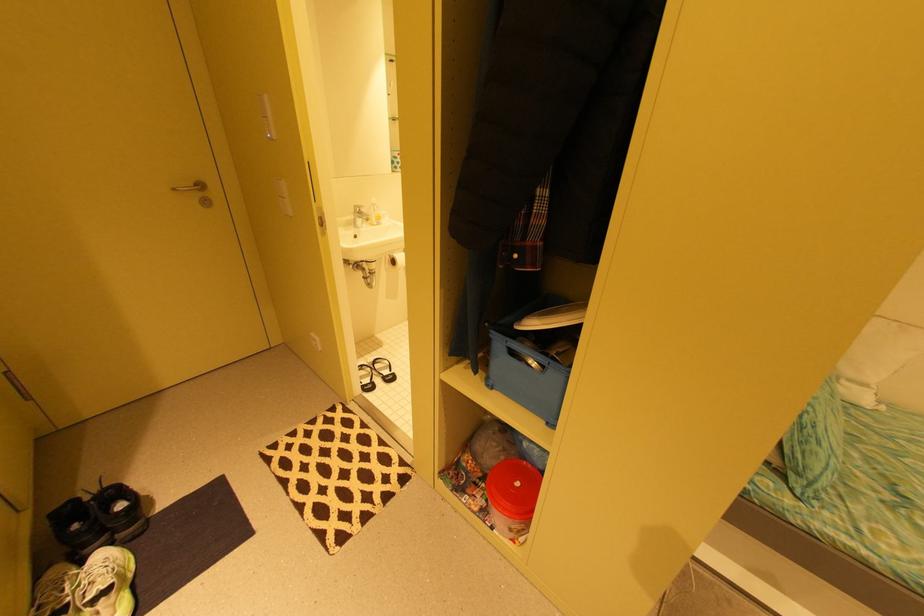
What do you see at coordinates (190, 188) in the screenshot? I see `the silver door handle` at bounding box center [190, 188].